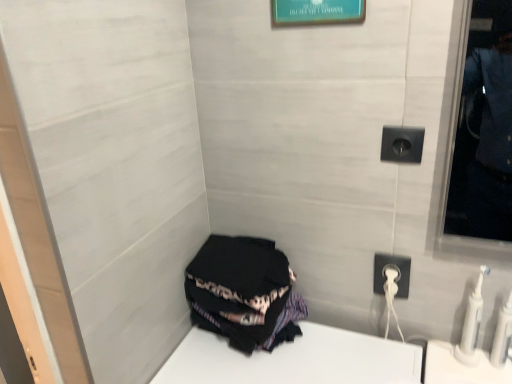
Question: In terms of height, does teal glossy picture frame at upper center look taller or shorter compared to white plastic toothbrush at lower right, which is counted as the 1th toiletry, starting from the left?

Choices:
 (A) short
 (B) tall

Answer: (A)

Question: Considering their positions, is teal glossy picture frame at upper center located in front of or behind white plastic toothbrush at lower right, acting as the second toiletry starting from the right?

Choices:
 (A) front
 (B) behind

Answer: (A)

Question: Considering the real-world distances, which object is closest to the black plastic outlet at upper right?

Choices:
 (A) teal glossy picture frame at upper center
 (B) white plastic toothbrush at lower right, acting as the second toiletry starting from the right
 (C) white plastic toothbrushes at lower right, acting as the 2th toiletry starting from the left
 (D) black fabric at lower left
 (E) white plastic power outlet at lower right

Answer: (E)

Question: Considering the real-world distances, which object is closest to the white plastic power outlet at lower right?

Choices:
 (A) black plastic outlet at upper right
 (B) teal glossy picture frame at upper center
 (C) white plastic toothbrush at lower right, which is counted as the 1th toiletry, starting from the left
 (D) white plastic toothbrushes at lower right, which ranks as the 1th toiletry in right-to-left order
 (E) black fabric at lower left

Answer: (C)